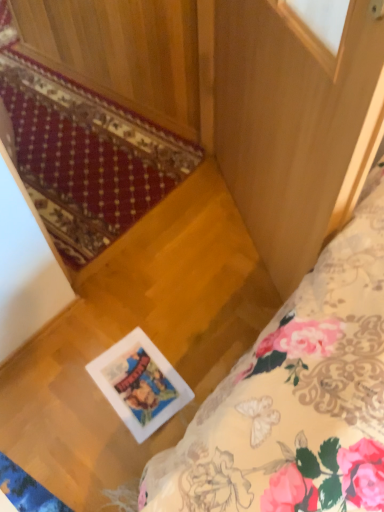
Image resolution: width=384 pixels, height=512 pixels. What are the coordinates of `blank space to the left of wooden screen door at center` in the screenshot? It's located at click(x=170, y=262).